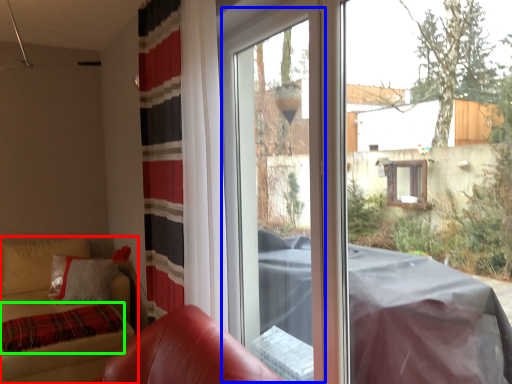
Question: Which is farther away from furniture (highlighted by a red box)? screen door (highlighted by a blue box) or blanket (highlighted by a green box)?

Choices:
 (A) screen door
 (B) blanket

Answer: (A)